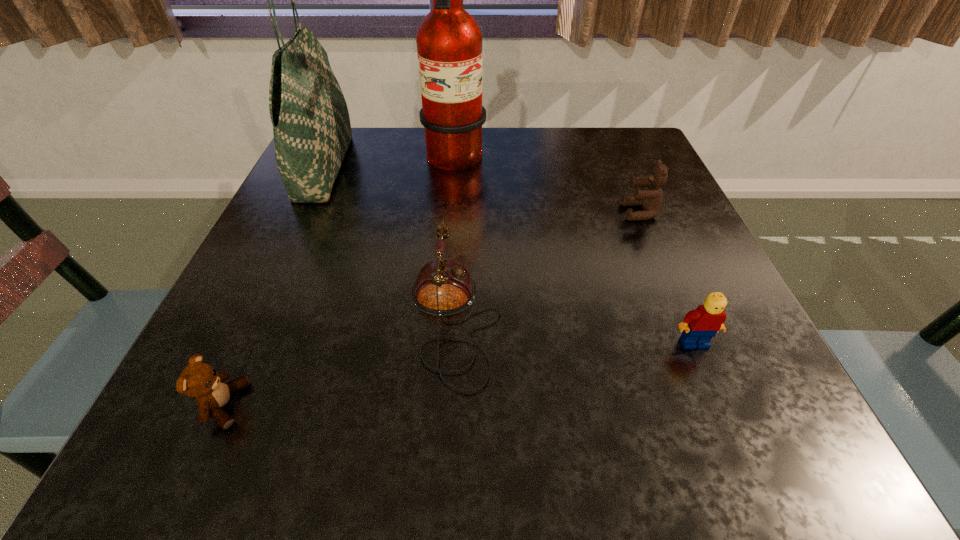
Locate an element on the screen. The width and height of the screenshot is (960, 540). teddy bear that is at the left edge is located at coordinates (199, 380).

The height and width of the screenshot is (540, 960). I want to click on teddy bear that is at the right edge, so click(x=650, y=199).

You are a GUI agent. You are given a task and a screenshot of the screen. Output one action in this format:
    pyautogui.click(x=<x>, y=<y>)
    Task: Click on the Lego positioned at the right edge
    
    Given the screenshot: What is the action you would take?
    tap(700, 325)

This screenshot has width=960, height=540. I want to click on object that is at the far left corner, so click(x=311, y=125).

At what (x,y) coordinates should I click in order to perform the action: click on object that is at the near left corner. Please return your answer as a coordinate pair (x, y). This screenshot has height=540, width=960. Looking at the image, I should click on (199, 380).

This screenshot has width=960, height=540. Find the location of `blank space at the far edge`. blank space at the far edge is located at coordinates (532, 148).

Image resolution: width=960 pixels, height=540 pixels. In the image, there is a desktop. What are the coordinates of `vacant area at the left edge` in the screenshot? It's located at (342, 252).

Find the location of a particular element. This screenshot has width=960, height=540. vacant region at the right edge is located at coordinates (634, 260).

In the image, there is a desktop. Identify the location of vacant space at the near right corner. (756, 429).

Identify the location of vacant space that's between the telephone and the taller teddy bear. This screenshot has height=540, width=960. (547, 266).